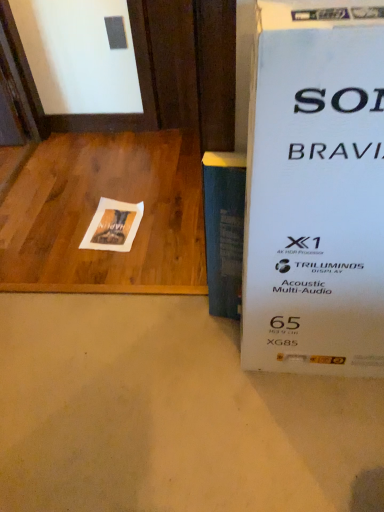
Measure the distance between white paper at center and camera.

The depth of white paper at center is 1.66 meters.

Locate an element on the screen. Image resolution: width=384 pixels, height=512 pixels. wooden at left is located at coordinates 95,210.

Locate an element on the screen. This screenshot has height=512, width=384. blue matte book at center is located at coordinates (224, 230).

Based on the photo, in terms of size, does blue matte book at center appear bigger or smaller than wooden at left?

In the image, blue matte book at center appears to be smaller than wooden at left.

Is blue matte book at center inside or outside of wooden at left?

blue matte book at center cannot be found inside wooden at left.

Would you consider blue matte book at center to be distant from wooden at left?

No.

From a real-world perspective, is blue matte book at center beneath wooden at left?

No.

This screenshot has width=384, height=512. In order to click on paperback book that appears above the white paper at center (from a real-world perspective) in this screenshot , I will do `click(224, 230)`.

From a real-world perspective, relative to white paper at center, is blue matte book at center vertically above or below?

Clearly, from a real-world perspective, blue matte book at center is above white paper at center.

Is blue matte book at center positioned with its back to white paper at center?

No, blue matte book at center is not facing the opposite direction of white paper at center.

Does blue matte book at center touch white paper at center?

No, blue matte book at center is not touching white paper at center.

Can you tell me how much wooden at left and blue matte book at center differ in facing direction?

5.92 degrees.

Is wooden at left shorter than blue matte book at center?

Correct, wooden at left is not as tall as blue matte book at center.

Consider the image. Is blue matte book at center at the back of wooden at left?

No, wooden at left is not facing the opposite direction of blue matte book at center.

Could blue matte book at center be considered to be inside wooden at left?

No, blue matte book at center is not surrounded by wooden at left.

Is wooden at left inside or outside of white paper at center?

wooden at left is located beyond the bounds of white paper at center.

Which of these two, wooden at left or white paper at center, is wider?

wooden at left is wider.

Considering the points (73, 250) and (98, 229), which point is behind, point (73, 250) or point (98, 229)?

Positioned behind is point (98, 229).

Are wooden at left and white paper at center beside each other?

No, wooden at left is not with white paper at center.

Could you tell me if white paper at center is turned towards wooden at left?

Yes.

Can you confirm if white paper at center is shorter than wooden at left?

Incorrect, the height of white paper at center does not fall short of that of wooden at left.

Which object is thinner, white paper at center or wooden at left?

With smaller width is white paper at center.

Which is in front, point (90, 224) or point (224, 197)?

The point (224, 197) is in front.

Can you confirm if white paper at center is wider than blue matte book at center?

Yes, white paper at center is wider than blue matte book at center.

From the image's perspective, which object appears higher, white paper at center or blue matte book at center?

white paper at center.

Is white paper at center facing towards blue matte book at center?

No.

This screenshot has width=384, height=512. Find the location of `table directly beneath the blue matte book at center (from a real-world perspective)`. table directly beneath the blue matte book at center (from a real-world perspective) is located at coordinates (95, 210).

Find the location of a particular element. This screenshot has height=512, width=384. paperback book to the right of white paper at center is located at coordinates (224, 230).

Based on their spatial positions, is wooden at left or white paper at center closer to blue matte book at center?

white paper at center is closer to blue matte book at center.

Estimate the real-world distances between objects in this image. Which object is further from white paper at center, blue matte book at center or wooden at left?

blue matte book at center is further to white paper at center.

Which object lies further to the anchor point blue matte book at center, white paper at center or wooden at left?

wooden at left lies further to blue matte book at center than the other object.

Based on their spatial positions, is white paper at center or blue matte book at center further from wooden at left?

blue matte book at center is positioned further to the anchor wooden at left.

Which object lies further to the anchor point white paper at center, wooden at left or blue matte book at center?

blue matte book at center is further to white paper at center.

From the image, which object appears to be farther from wooden at left, blue matte book at center or white paper at center?

blue matte book at center is positioned further to the anchor wooden at left.

The width and height of the screenshot is (384, 512). In order to click on table between blue matte book at center and white paper at center along the z-axis in this screenshot , I will do `click(95, 210)`.